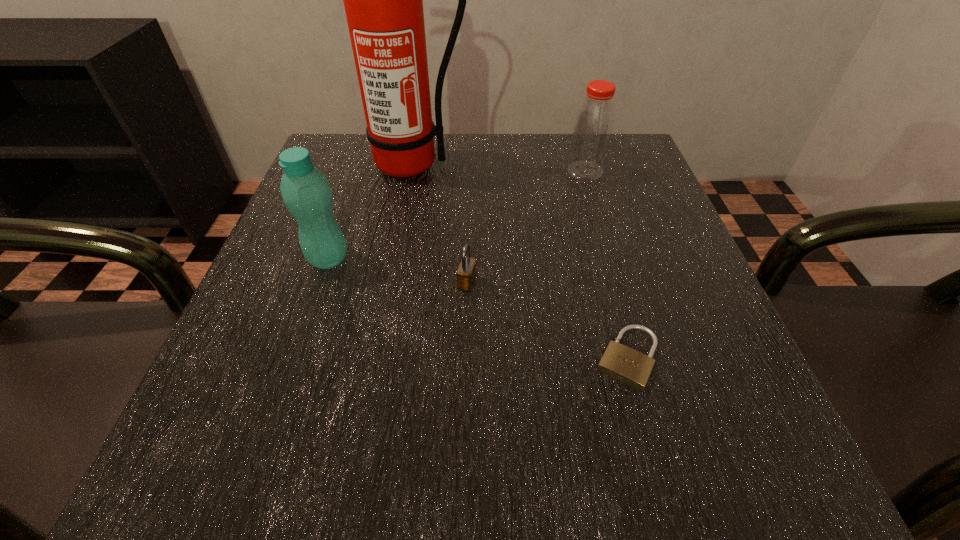
Where is `the tallest object`? The image size is (960, 540). the tallest object is located at coordinates (383, 0).

Locate an element on the screen. This screenshot has height=540, width=960. the nearer bottle is located at coordinates (305, 190).

Find the location of `the farther bottle`. the farther bottle is located at coordinates (594, 123).

Image resolution: width=960 pixels, height=540 pixels. I want to click on the left padlock, so click(466, 273).

Find the location of `the farther padlock`. the farther padlock is located at coordinates (466, 273).

You are a GUI agent. You are given a task and a screenshot of the screen. Output one action in this format:
    pyautogui.click(x=<x>, y=<y>)
    Task: Click on the shortest object
    Image resolution: width=960 pixels, height=540 pixels.
    Given the screenshot: What is the action you would take?
    click(x=631, y=367)

Locate an element on the screen. the right padlock is located at coordinates (631, 367).

What are the coordinates of `vacant space located 0.280m on the handle side of the tallest object` in the screenshot? It's located at (390, 278).

Where is `vacant space positioned 0.190m on the front of the nearer bottle`? vacant space positioned 0.190m on the front of the nearer bottle is located at coordinates (289, 372).

The width and height of the screenshot is (960, 540). In order to click on free space located 0.080m on the front of the farther bottle in this screenshot , I will do `click(595, 205)`.